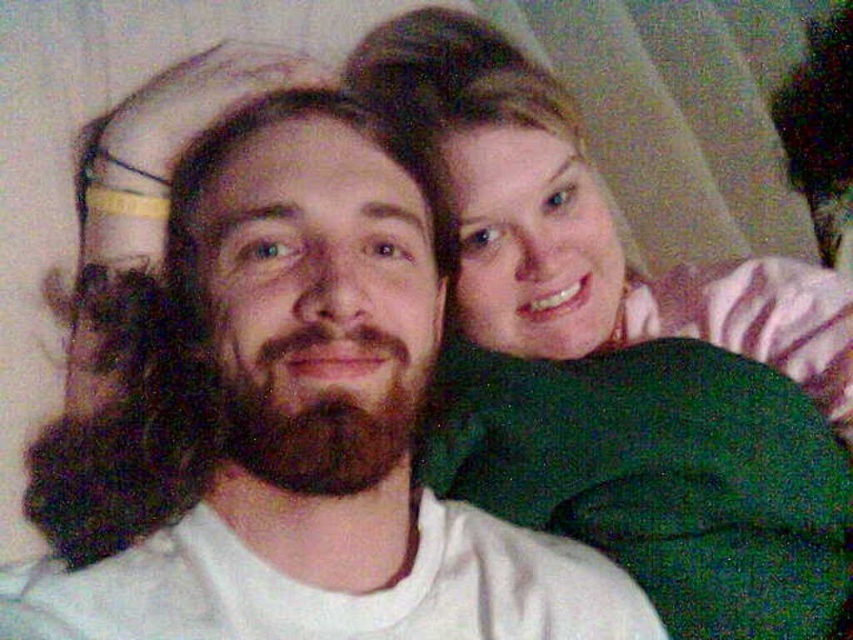
You are a photographer setting up for a close portrait. You need to ensure that the matte green sweater at upper right and the dark brown thick beard at center are both in focus. The depth of field in your camera can cover 12 inches. Will both objects be in focus?

The distance between the matte green sweater at upper right and the dark brown thick beard at center is 13.25 inches, which exceeds the camera depth of field of 12 inches. Therefore, both objects cannot be in focus simultaneously.

You are designing a new app that requires knowing the relative sizes of objects in the image. Given the matte green sweater at upper right and the dark brown thick beard at center, which object is wider?

The matte green sweater at upper right is wider than the dark brown thick beard at center according to the description.